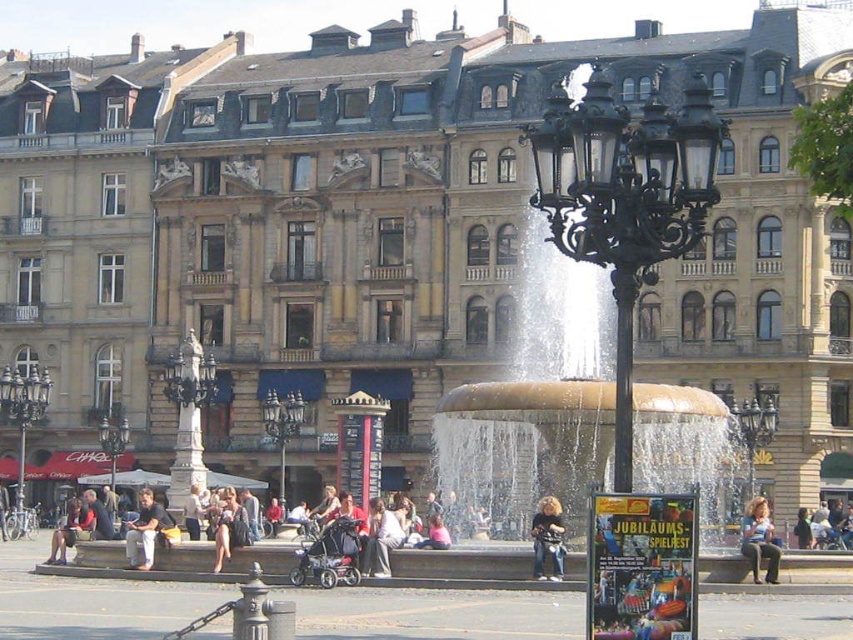
You are a photographer planning to capture a photo of the black wrought iron streetlight at center and the dark brown leather jacket at center in the urban square. Since you want to ensure both subjects are in focus, you need to know their relative heights. Can you determine which one is taller?

The black wrought iron streetlight at center is much taller than the dark brown leather jacket at center, so the streetlight will be taller in the photo.

You are standing at the black wrought iron streetlight at center in the urban square. You want to take a photo of the camera that is 32.35 meters away. Is the camera within the typical 50 meter range of your camera lens? Please explain.

The camera is 32.35 meters away from the black wrought iron streetlight at center. Since 32.35 meters is less than 50 meters, the camera is within the typical 50 meter range of your camera lens.

In the scene shown: You are standing in the urban square and see the gold polished water at center and the dark brown leather jacket at center. Which object is located higher in the scene?

The gold polished water at center is above the dark brown leather jacket at center, so the gold polished water at center is higher in the scene.